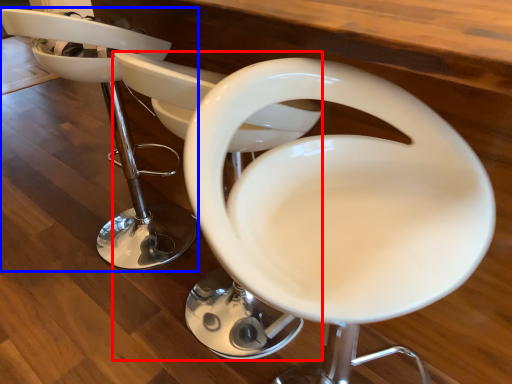
Question: Which object appears farthest to the camera in this image, feeding chair (highlighted by a red box) or chair (highlighted by a blue box)?

Choices:
 (A) feeding chair
 (B) chair

Answer: (B)